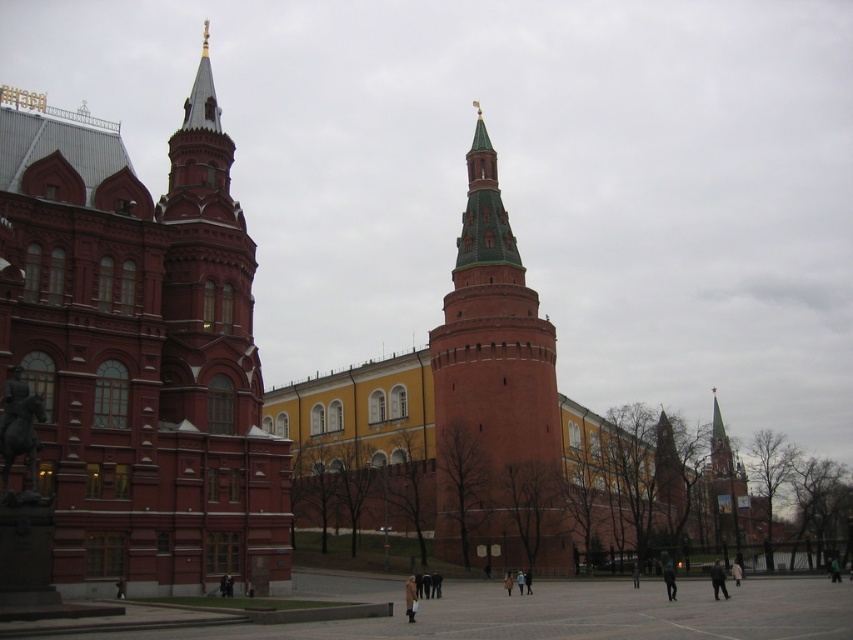
Question: Does smooth brick tower at center come in front of brick tower at center?

Choices:
 (A) no
 (B) yes

Answer: (B)

Question: In this image, where is smooth brick church at left located relative to brick tower at center?

Choices:
 (A) left
 (B) right

Answer: (A)

Question: Which of these objects is positioned farthest from the brick tower at center?

Choices:
 (A) smooth brick tower at center
 (B) smooth brick church at left

Answer: (B)

Question: Which object is closer to the camera taking this photo?

Choices:
 (A) smooth brick tower at center
 (B) brick tower at center
 (C) smooth brick church at left

Answer: (C)

Question: Which point appears farthest from the camera in this image?

Choices:
 (A) (56, 534)
 (B) (480, 364)

Answer: (B)

Question: Can you confirm if smooth brick church at left is bigger than smooth brick tower at center?

Choices:
 (A) no
 (B) yes

Answer: (A)